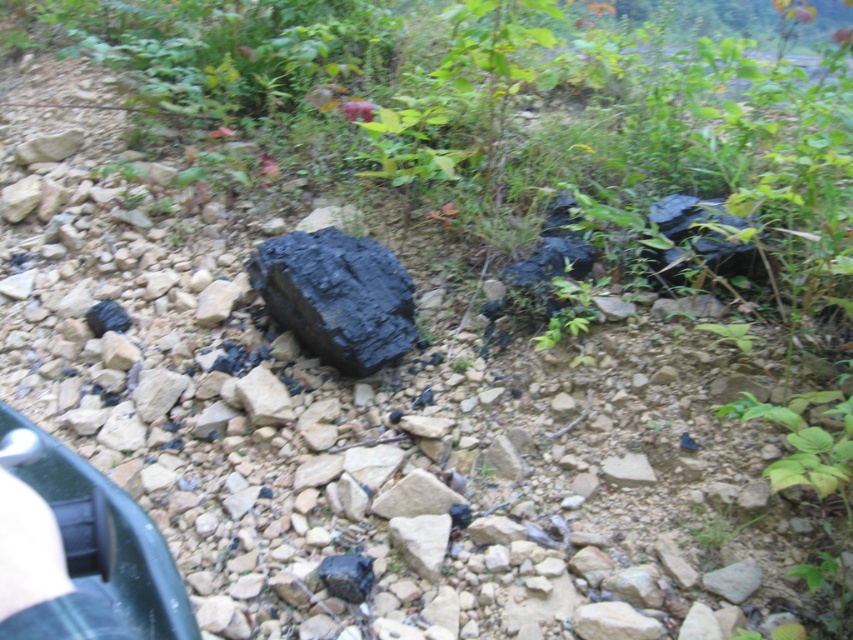
Question: Which of the following is the farthest from the observer?

Choices:
 (A) (90, 612)
 (B) (384, 284)

Answer: (B)

Question: In this image, where is black matte rock at center located relative to blue denim jeans at lower left?

Choices:
 (A) above
 (B) below

Answer: (A)

Question: Which object is closer to the camera taking this photo?

Choices:
 (A) black matte rock at center
 (B) blue denim jeans at lower left

Answer: (B)

Question: Does black matte rock at center have a larger size compared to blue denim jeans at lower left?

Choices:
 (A) no
 (B) yes

Answer: (B)

Question: Is black matte rock at center bigger than blue denim jeans at lower left?

Choices:
 (A) no
 (B) yes

Answer: (B)